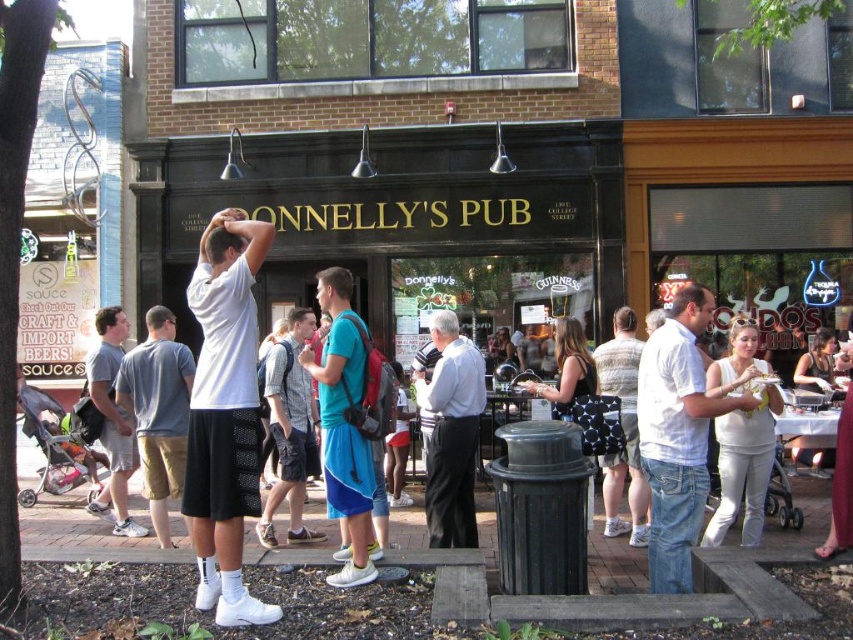
How far apart are gray cotton shorts at lower left and denim shorts at center?

gray cotton shorts at lower left is 36.84 inches from denim shorts at center.

The width and height of the screenshot is (853, 640). I want to click on gray cotton shorts at lower left, so click(x=158, y=412).

From the picture: Can you confirm if blue fabric backpack at center is taller than gray wool suit at center?

Correct, blue fabric backpack at center is much taller as gray wool suit at center.

Who is positioned more to the left, blue fabric backpack at center or gray wool suit at center?

blue fabric backpack at center

Is point (352, 442) positioned after point (461, 531)?

No, (352, 442) is closer to viewer.

Locate an element on the screen. blue fabric backpack at center is located at coordinates (344, 426).

Who is positioned more to the left, white cotton shirt at center or gray cotton shorts at lower left?

gray cotton shorts at lower left is more to the left.

Is white cotton shirt at center taller than gray cotton shorts at lower left?

Yes, white cotton shirt at center is taller than gray cotton shorts at lower left.

Is point (657, 378) closer to viewer compared to point (166, 413)?

That is True.

The image size is (853, 640). I want to click on white cotton shirt at center, so click(x=677, y=435).